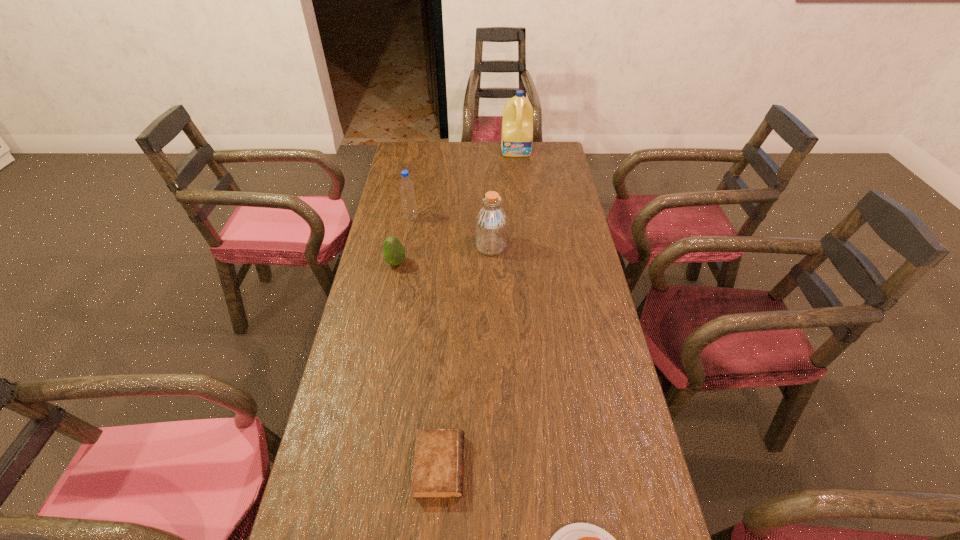
Locate an element on the screen. free space located on the back of the avocado is located at coordinates (404, 223).

Identify the location of vacant space located on the spine side of the diary. (491, 466).

Locate an element on the screen. This screenshot has height=540, width=960. object at the far edge is located at coordinates (517, 124).

Locate an element on the screen. The width and height of the screenshot is (960, 540). water bottle that is at the left edge is located at coordinates (406, 186).

The width and height of the screenshot is (960, 540). I want to click on avocado situated at the left edge, so click(394, 253).

This screenshot has height=540, width=960. I want to click on object at the right edge, so 517,124.

Locate an element on the screen. object at the far right corner is located at coordinates (517, 124).

Identify the location of vacant space at the far edge of the desktop. The width and height of the screenshot is (960, 540). (466, 157).

I want to click on vacant space at the left edge, so click(352, 346).

Locate an element on the screen. Image resolution: width=960 pixels, height=540 pixels. vacant region at the right edge of the desktop is located at coordinates (558, 210).